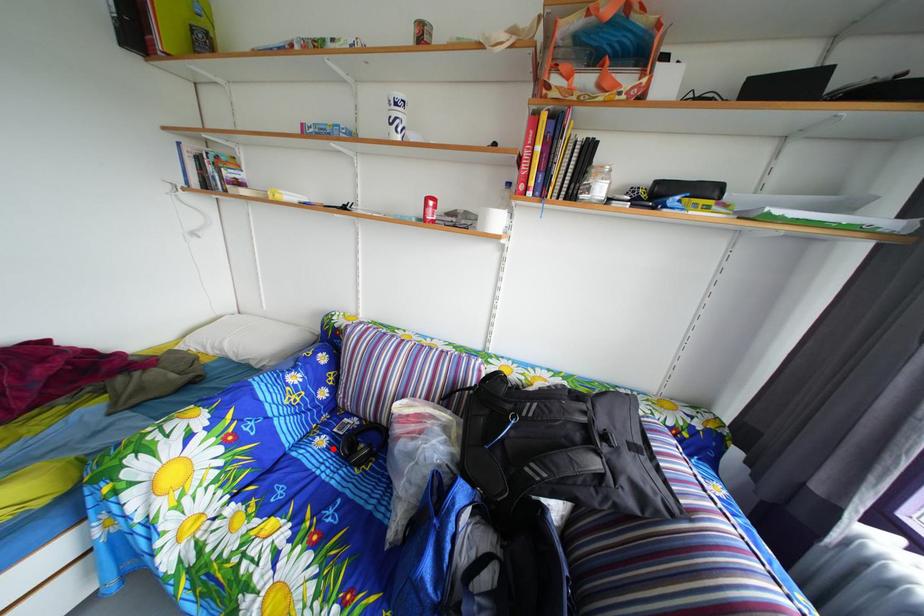
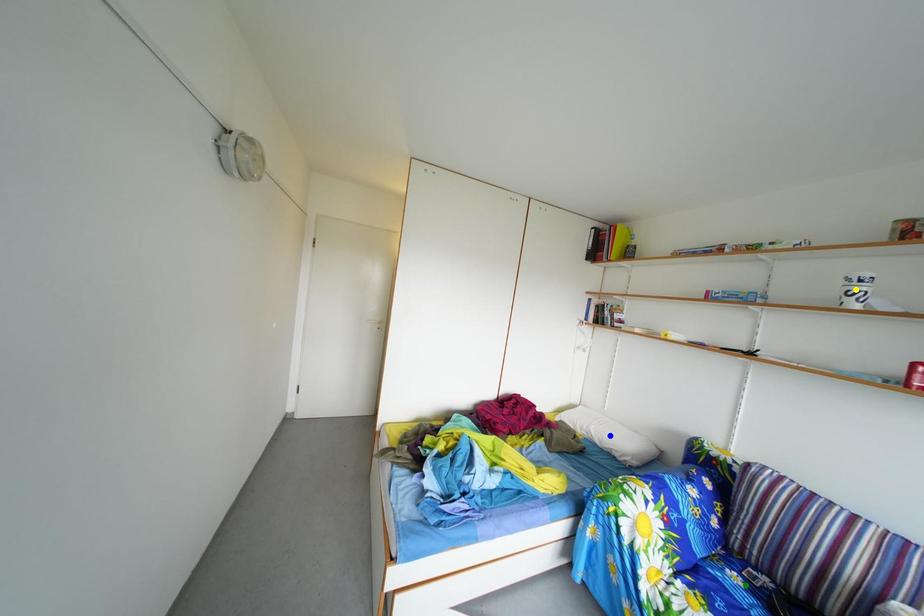
Question: I am providing you with two images of the same scene from different viewpoints. A red point is marked on the first image. You are given multiple points on the second image. Which spot in image 2 lines up with the point in image 1?

Choices:
 (A) blue point
 (B) green point
 (C) yellow point

Answer: (B)